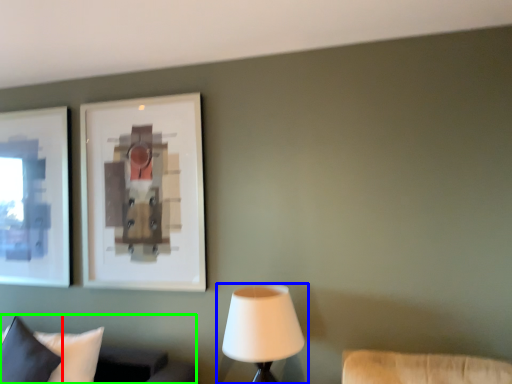
Question: Considering the real-world distances, which object is farthest from pillow (highlighted by a red box)? lamp (highlighted by a blue box) or furniture (highlighted by a green box)?

Choices:
 (A) lamp
 (B) furniture

Answer: (A)